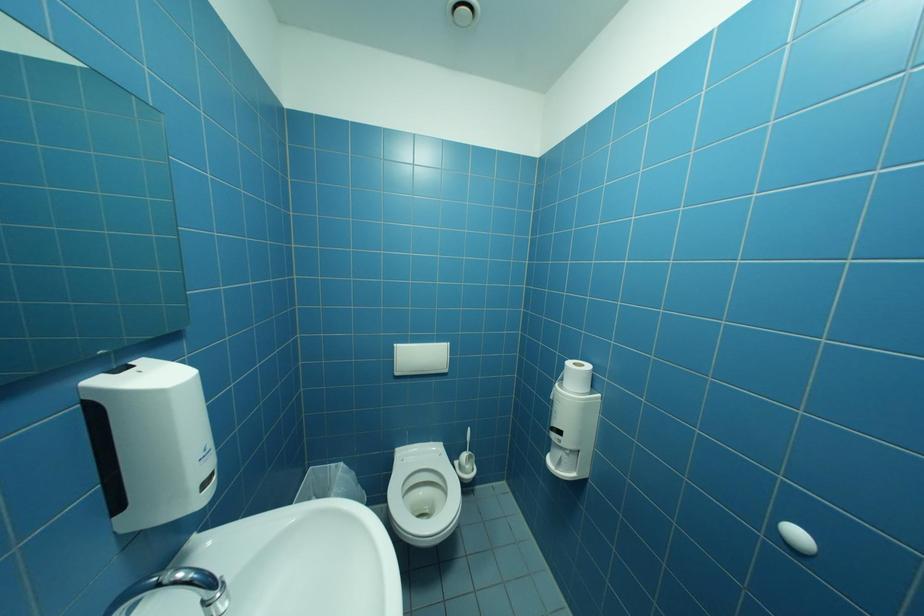
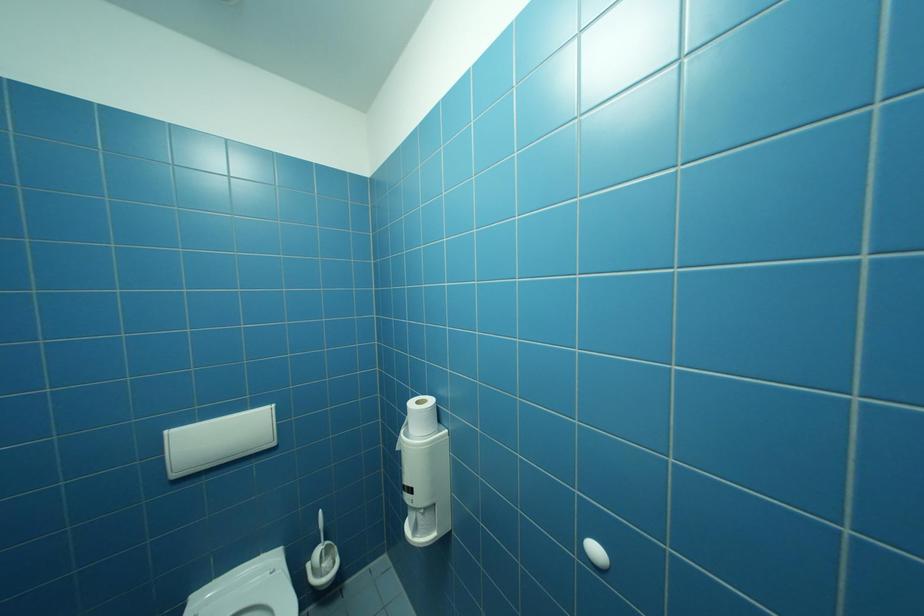
Question: Which direction would the cameraman need to move to produce the second image? Reply with the corresponding letter.

Choices:
 (A) Left
 (B) Right
 (C) Forward
 (D) Backward

Answer: (B)